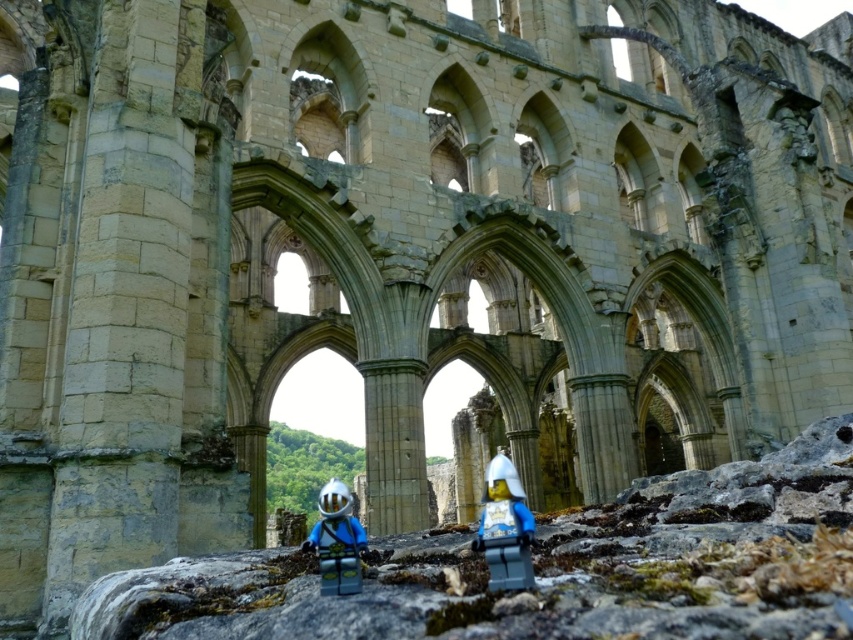
You are standing in the grand stone structure and see the point at coordinates (505, 528). What object is located at that point?

The point at coordinates (505, 528) corresponds to the smooth plastic helmet at center.

You are a visitor exploring the ruins and want to place a small LEGO figure on the rocky surface. Which object, the smooth plastic helmet at center or the matte blue plastic minifigure at center, is shorter in height?

The smooth plastic helmet at center is not as tall as the matte blue plastic minifigure at center, so the smooth plastic helmet at center is shorter.